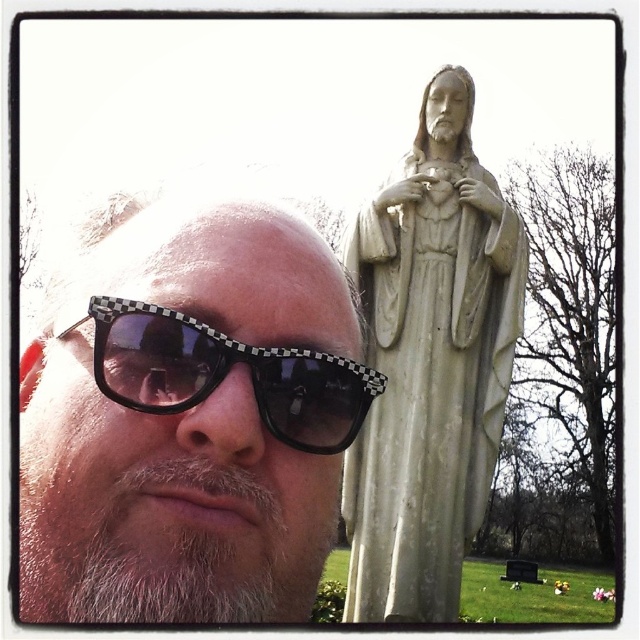
Question: Which point is farther to the camera?

Choices:
 (A) (113, 397)
 (B) (502, 336)
 (C) (45, 445)

Answer: (B)

Question: Can you confirm if white stone statue at center is positioned above black checkered sunglasses at center?

Choices:
 (A) yes
 (B) no

Answer: (A)

Question: Which point is closer to the camera?

Choices:
 (A) (445, 458)
 (B) (60, 292)

Answer: (B)

Question: Does white matte sunglasses at left have a lesser width compared to black checkered sunglasses at center?

Choices:
 (A) yes
 (B) no

Answer: (B)

Question: Is white matte sunglasses at left bigger than black checkered sunglasses at center?

Choices:
 (A) no
 (B) yes

Answer: (B)

Question: Which object appears farthest from the camera in this image?

Choices:
 (A) white stone statue at center
 (B) white matte sunglasses at left

Answer: (A)